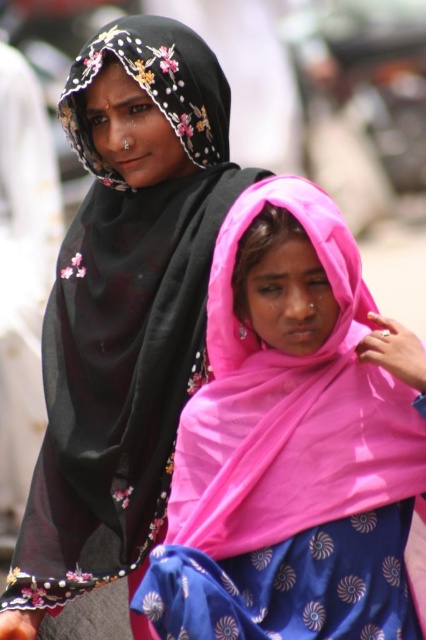
Is black sheer scarf at upper left bigger than black sheer headscarf at upper left?

Yes, black sheer scarf at upper left is bigger than black sheer headscarf at upper left.

Who is taller, black sheer scarf at upper left or black sheer headscarf at upper left?

black sheer scarf at upper left is taller.

In order to click on black sheer scarf at upper left in this screenshot , I will do `click(123, 307)`.

Does pink satin scarf at center have a greater height compared to black sheer scarf at upper left?

No.

The height and width of the screenshot is (640, 426). Describe the element at coordinates (293, 444) in the screenshot. I see `pink satin scarf at center` at that location.

Between point (230, 419) and point (112, 186), which one is positioned behind?

Point (112, 186)

Where is `pink satin scarf at center`? pink satin scarf at center is located at coordinates (293, 444).

Can you confirm if pink satin scarf at center is shorter than black sheer headscarf at upper left?

Yes.

Who is higher up, pink satin scarf at center or black sheer headscarf at upper left?

Positioned higher is black sheer headscarf at upper left.

This screenshot has width=426, height=640. Find the location of `pink satin scarf at center`. pink satin scarf at center is located at coordinates (293, 444).